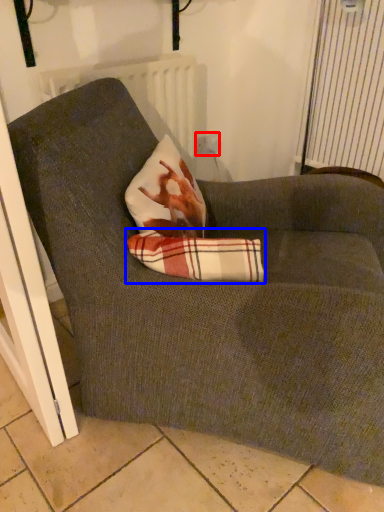
Question: Which of the following is the farthest to the observer, electric outlet (highlighted by a red box) or plaid (highlighted by a blue box)?

Choices:
 (A) electric outlet
 (B) plaid

Answer: (A)